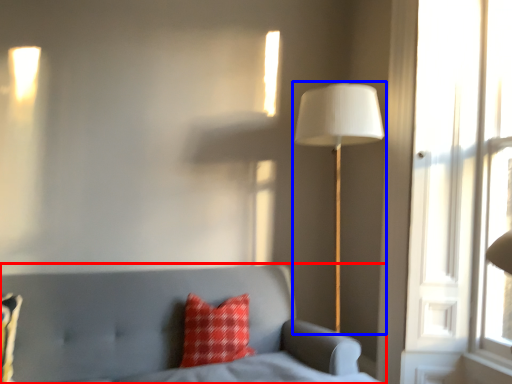
Question: Which of the following is the farthest to the observer, furniture (highlighted by a red box) or lamp (highlighted by a blue box)?

Choices:
 (A) furniture
 (B) lamp

Answer: (B)